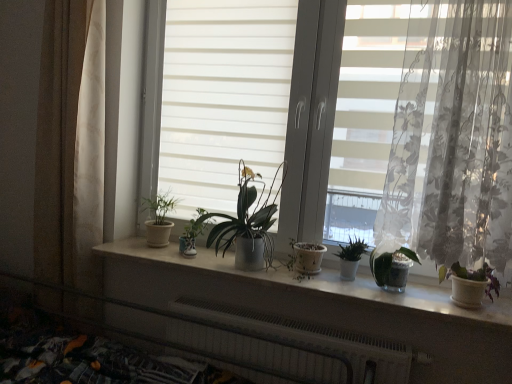
At what (x,y) coordinates should I click in order to perform the action: click on green matte plant at center, arranged as the fifth houseplant when viewed from the right. Please return your answer as a coordinate pair (x, y). Image resolution: width=512 pixels, height=384 pixels. Looking at the image, I should click on (193, 233).

Describe the element at coordinates (248, 223) in the screenshot. I see `matte white pot at center, which ranks as the third houseplant in left-to-right order` at that location.

What do you see at coordinates (309, 338) in the screenshot?
I see `white metallic radiator at lower center` at bounding box center [309, 338].

Locate an element on the screen. The height and width of the screenshot is (384, 512). white matte window at center is located at coordinates (353, 113).

This screenshot has width=512, height=384. Describe the element at coordinates (353, 113) in the screenshot. I see `white matte window at center` at that location.

Based on the photo, measure the distance between point (x=353, y=256) and camera.

The depth of point (x=353, y=256) is 5.82 feet.

Measure the distance between point (372, 273) and camera.

1.79 meters.

Find the location of `translucent glass vase at right, positioned as the second houseplant in right-to-left order`. translucent glass vase at right, positioned as the second houseplant in right-to-left order is located at coordinates (391, 267).

Identify the location of purple matte plant at right, the sixth houseplant from the left. The width and height of the screenshot is (512, 384). (470, 284).

Does translucent glass vase at right, the fifth houseplant positioned from the left, touch white metallic radiator at lower center?

No, translucent glass vase at right, the fifth houseplant positioned from the left, is not in contact with white metallic radiator at lower center.

From a real-world perspective, which houseplant is the 2nd one above the white metallic radiator at lower center? Please provide its 2D coordinates.

[(391, 267)]

From the image's perspective, between translucent glass vase at right, the fifth houseplant positioned from the left, and white metallic radiator at lower center, which one is located above?

translucent glass vase at right, the fifth houseplant positioned from the left, from the image's perspective.

Can you confirm if translucent glass vase at right, the fifth houseplant positioned from the left, is bigger than white metallic radiator at lower center?

No.

Considering the relative sizes of white matte window at center and translucent glass vase at right, the fifth houseplant positioned from the left, in the image provided, is white matte window at center smaller than translucent glass vase at right, the fifth houseplant positioned from the left,?

No.

Which of these two, white matte window at center or translucent glass vase at right, the fifth houseplant positioned from the left, stands taller?

With more height is white matte window at center.

Could you tell me if white matte window at center is turned towards translucent glass vase at right, positioned as the second houseplant in right-to-left order?

Yes, white matte window at center faces towards translucent glass vase at right, positioned as the second houseplant in right-to-left order.

This screenshot has height=384, width=512. Identify the location of the 2nd houseplant counting from the right side of the white matte window at center. (391, 267).

Which is correct: matte white pot at center, the fourth houseplant positioned from the right, is inside white metallic radiator at lower center, or outside of it?

The correct answer is: outside.

In the image, is matte white pot at center, which ranks as the third houseplant in left-to-right order, positioned in front of or behind white metallic radiator at lower center?

Visually, matte white pot at center, which ranks as the third houseplant in left-to-right order, is located behind white metallic radiator at lower center.

Locate an element on the screen. radiator that appears below the matte white pot at center, which ranks as the third houseplant in left-to-right order (from a real-world perspective) is located at coordinates (309, 338).

In terms of height, does matte white pot at center, the fourth houseplant positioned from the right, look taller or shorter compared to white metallic radiator at lower center?

matte white pot at center, the fourth houseplant positioned from the right, is taller than white metallic radiator at lower center.

Is matte white pot at left, the 1th houseplant in the left-to-right sequence, far away from matte white pot at center, the fourth houseplant positioned from the right?

No.

From the image's perspective, relative to matte white pot at center, the fourth houseplant positioned from the right, is matte white pot at left, the 1th houseplant in the left-to-right sequence, above or below?

Clearly, from the image's perspective, matte white pot at left, the 1th houseplant in the left-to-right sequence, is below matte white pot at center, the fourth houseplant positioned from the right.

Is matte white pot at left, the 1th houseplant in the left-to-right sequence, positioned with its back to matte white pot at center, the fourth houseplant positioned from the right?

matte white pot at left, the 1th houseplant in the left-to-right sequence, does not have its back to matte white pot at center, the fourth houseplant positioned from the right.

Considering the positions of objects matte white pot at left, the 1th houseplant in the left-to-right sequence, and matte white pot at center, which ranks as the third houseplant in left-to-right order, in the image provided, who is in front, matte white pot at left, the 1th houseplant in the left-to-right sequence, or matte white pot at center, which ranks as the third houseplant in left-to-right order,?

matte white pot at center, which ranks as the third houseplant in left-to-right order, is in front.

Is translucent floral fabric at right, which is counted as the 2th curtain, starting from the left, at the left side of translucent glass vase at right, positioned as the second houseplant in right-to-left order?

In fact, translucent floral fabric at right, which is counted as the 2th curtain, starting from the left, is to the right of translucent glass vase at right, positioned as the second houseplant in right-to-left order.

Which of these two, translucent floral fabric at right, which is counted as the 2th curtain, starting from the left, or translucent glass vase at right, the fifth houseplant positioned from the left, stands taller?

translucent floral fabric at right, which is counted as the 2th curtain, starting from the left, is taller.

From the image's perspective, which is above, translucent floral fabric at right, which is the first curtain in front-to-back order, or translucent glass vase at right, positioned as the second houseplant in right-to-left order?

translucent floral fabric at right, which is the first curtain in front-to-back order.

Looking at this image, does white ceramic window sill at center turn towards matte white pot at center, the fourth houseplant positioned from the right?

No.

Is white ceramic window sill at center shorter than matte white pot at center, which ranks as the third houseplant in left-to-right order?

→ Indeed, white ceramic window sill at center has a lesser height compared to matte white pot at center, which ranks as the third houseplant in left-to-right order.

From the image's perspective, between white ceramic window sill at center and matte white pot at center, the fourth houseplant positioned from the right, who is located below?

white ceramic window sill at center appears lower in the image.

Considering their positions, is white ceramic window sill at center located in front of or behind matte white pot at center, the fourth houseplant positioned from the right?

white ceramic window sill at center is in front of matte white pot at center, the fourth houseplant positioned from the right.

Does point (44, 134) lie behind point (385, 274)?

Yes, it is.

From a real-world perspective, who is located lower, beige fabric curtain at left, arranged as the first curtain when viewed from the left, or translucent glass vase at right, the fifth houseplant positioned from the left?

In real-world perspective, translucent glass vase at right, the fifth houseplant positioned from the left, is lower.

Considering the sizes of beige fabric curtain at left, arranged as the first curtain when viewed from the left, and translucent glass vase at right, the fifth houseplant positioned from the left, in the image, is beige fabric curtain at left, arranged as the first curtain when viewed from the left, bigger or smaller than translucent glass vase at right, the fifth houseplant positioned from the left,?

Clearly, beige fabric curtain at left, arranged as the first curtain when viewed from the left, is larger in size than translucent glass vase at right, the fifth houseplant positioned from the left.

Would you say translucent glass vase at right, positioned as the second houseplant in right-to-left order, is part of beige fabric curtain at left, arranged as the first curtain when viewed from the left,'s contents?

No, translucent glass vase at right, positioned as the second houseplant in right-to-left order, is not a part of beige fabric curtain at left, arranged as the first curtain when viewed from the left.

Which houseplant is the 2nd one when counting from the right side of the white metallic radiator at lower center? Please provide its 2D coordinates.

[(391, 267)]

Identify the location of window lying in front of the translucent glass vase at right, the fifth houseplant positioned from the left. (353, 113).

Considering their positions, is matte white pot at left, the 1th houseplant in the left-to-right sequence, positioned closer to translucent glass vase at right, the fifth houseplant positioned from the left, than translucent floral fabric at right, the 2th curtain in the back-to-front sequence?

The object closer to translucent glass vase at right, the fifth houseplant positioned from the left, is translucent floral fabric at right, the 2th curtain in the back-to-front sequence.

Looking at the image, which one is located further to green matte plant at center, placed as the 3th houseplant when sorted from right to left, white matte window at center or matte white pot at center, which ranks as the third houseplant in left-to-right order?

white matte window at center lies further to green matte plant at center, placed as the 3th houseplant when sorted from right to left, than the other object.

Estimate the real-world distances between objects in this image. Which object is further from purple matte plant at right, the sixth houseplant from the left, beige fabric curtain at left, arranged as the first curtain when viewed from the left, or green matte plant at center, placed as the 3th houseplant when sorted from right to left?

Among the two, beige fabric curtain at left, arranged as the first curtain when viewed from the left, is located further to purple matte plant at right, the sixth houseplant from the left.

Considering their positions, is purple matte plant at right, the sixth houseplant from the left, positioned closer to white matte window at center than matte white pot at center, the fourth houseplant positioned from the right?

Based on the image, matte white pot at center, the fourth houseplant positioned from the right, appears to be nearer to white matte window at center.

Based on their spatial positions, is beige fabric curtain at left, the second curtain positioned from the right, or green matte plant at center, arranged as the fifth houseplant when viewed from the right, closer to white ceramic window sill at center?

Among the two, green matte plant at center, arranged as the fifth houseplant when viewed from the right, is located nearer to white ceramic window sill at center.

Based on their spatial positions, is purple matte plant at right, the sixth houseplant from the left, or beige fabric curtain at left, the second curtain positioned from the right, closer to matte white pot at left, the 1th houseplant in the left-to-right sequence?

Among the two, beige fabric curtain at left, the second curtain positioned from the right, is located nearer to matte white pot at left, the 1th houseplant in the left-to-right sequence.

Estimate the real-world distances between objects in this image. Which object is further from translucent glass vase at right, the fifth houseplant positioned from the left, purple matte plant at right, the sixth houseplant from the left, or matte white pot at center, the fourth houseplant positioned from the right?

Among the two, matte white pot at center, the fourth houseplant positioned from the right, is located further to translucent glass vase at right, the fifth houseplant positioned from the left.

Based on their spatial positions, is white matte window at center or translucent glass vase at right, positioned as the second houseplant in right-to-left order, closer to white ceramic window sill at center?

translucent glass vase at right, positioned as the second houseplant in right-to-left order, is closer to white ceramic window sill at center.

Where is `radiator situated between green matte plant at center, arranged as the fifth houseplant when viewed from the right, and purple matte plant at right, the sixth houseplant from the left, from left to right`? radiator situated between green matte plant at center, arranged as the fifth houseplant when viewed from the right, and purple matte plant at right, the sixth houseplant from the left, from left to right is located at coordinates (309, 338).

The width and height of the screenshot is (512, 384). Find the location of `window sill located between beige fabric curtain at left, the second curtain positioned from the right, and green matte plant at center, which appears as the fourth houseplant when viewed from the left, in the left-right direction`. window sill located between beige fabric curtain at left, the second curtain positioned from the right, and green matte plant at center, which appears as the fourth houseplant when viewed from the left, in the left-right direction is located at coordinates (319, 282).

I want to click on radiator situated between beige fabric curtain at left, the second curtain positioned from the right, and white matte window at center from left to right, so [x=309, y=338].

Find the location of a particular element. houseplant located between matte white pot at center, the fourth houseplant positioned from the right, and translucent glass vase at right, positioned as the second houseplant in right-to-left order, in the left-right direction is located at coordinates (351, 258).